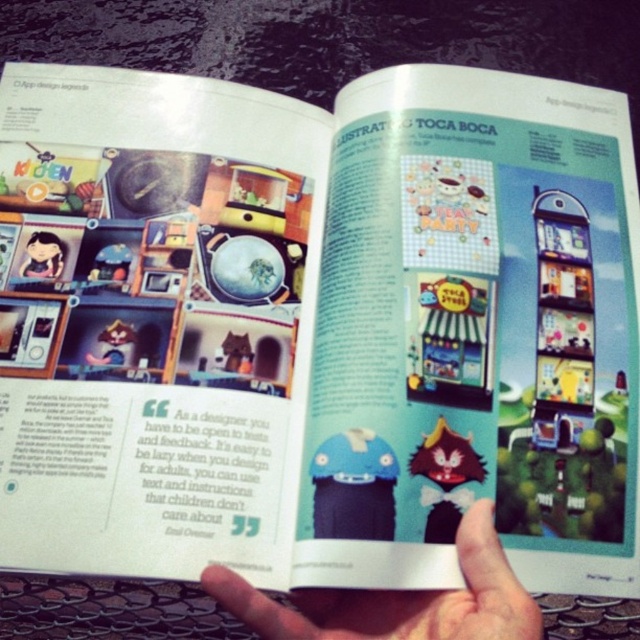
Is smooth skin hand at center to the right of matte black doll at upper left from the viewer's perspective?

Yes, smooth skin hand at center is to the right of matte black doll at upper left.

The height and width of the screenshot is (640, 640). Describe the element at coordinates (397, 600) in the screenshot. I see `smooth skin hand at center` at that location.

Identify the location of smooth skin hand at center. (397, 600).